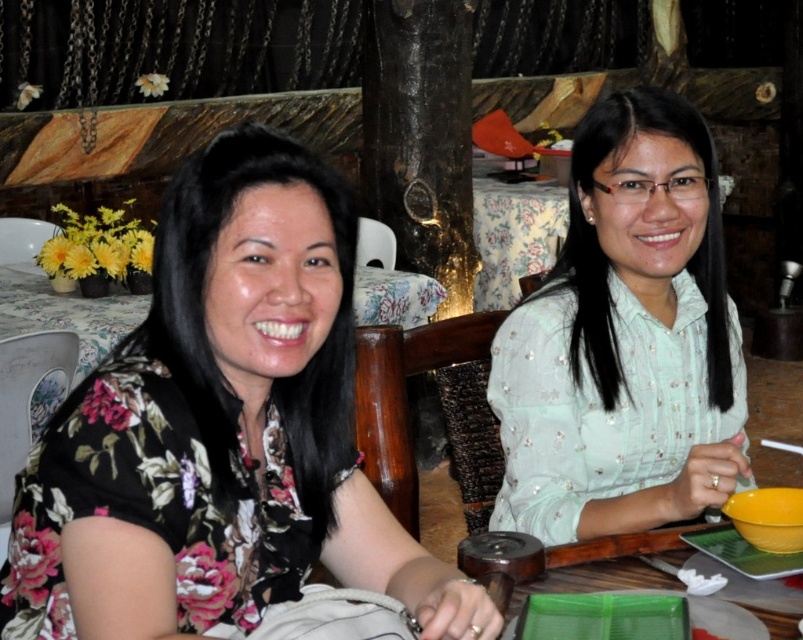
Question: Can you confirm if floral print blouse at left is smaller than yellow matte bowl at lower right?

Choices:
 (A) yes
 (B) no

Answer: (B)

Question: Estimate the real-world distances between objects in this image. Which object is farther from the yellow matte bowl at lower right?

Choices:
 (A) floral print blouse at left
 (B) light green fabric shirt at center
 (C) green plastic tray at lower right
 (D) floral fabric table at center

Answer: (D)

Question: Which point is closer to the camera taking this photo?

Choices:
 (A) (775, 515)
 (B) (622, 257)
 (C) (251, 208)
 (D) (761, 605)

Answer: (C)

Question: Does floral print blouse at left have a smaller size compared to floral fabric table at center?

Choices:
 (A) yes
 (B) no

Answer: (A)

Question: Is light green fabric shirt at center behind yellow matte bowl at lower right?

Choices:
 (A) yes
 (B) no

Answer: (A)

Question: Which of the following is the farthest from the observer?

Choices:
 (A) floral print blouse at left
 (B) light green fabric shirt at center
 (C) yellow matte bowl at lower right
 (D) green plastic tray at lower right

Answer: (B)